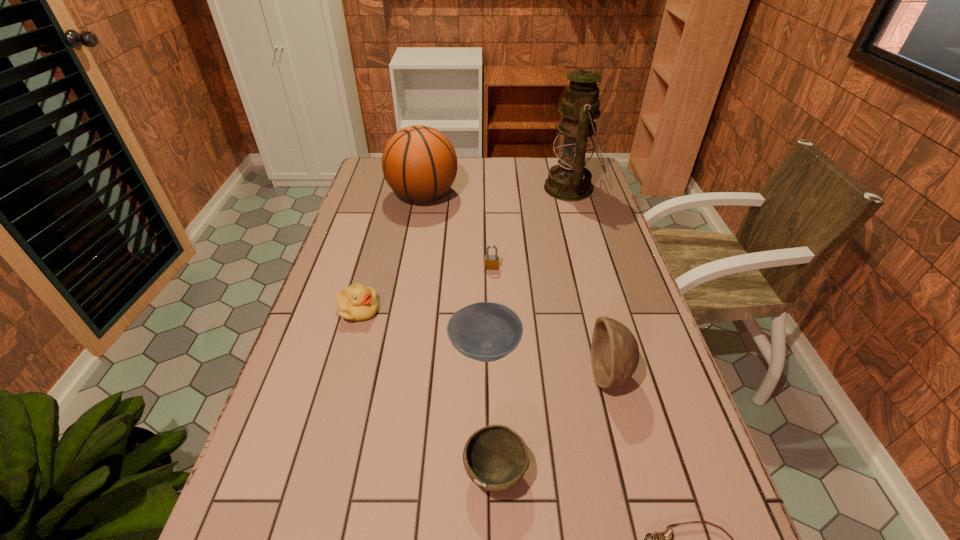
I want to click on vacant space located 0.190m on the beak of the duckling, so click(450, 310).

Identify the location of vacant space positioned 0.380m on the right of the third farthest object. (627, 267).

What are the coordinates of `vacant space located on the back of the nearest bowl` in the screenshot? It's located at (493, 420).

What are the coordinates of `oil lamp present at the far edge` in the screenshot? It's located at (569, 180).

Where is `basketball at the far edge`? basketball at the far edge is located at coordinates (419, 163).

You are a GUI agent. You are given a task and a screenshot of the screen. Output one action in this format:
    pyautogui.click(x=<x>, y=<y>)
    Task: Click on the basketball present at the left edge
    
    Given the screenshot: What is the action you would take?
    pyautogui.click(x=419, y=163)

Identify the location of duckling present at the left edge. The image size is (960, 540). (357, 303).

This screenshot has width=960, height=540. I want to click on oil lamp at the right edge, so click(569, 180).

I want to click on bowl that is at the right edge, so click(614, 350).

Image resolution: width=960 pixels, height=540 pixels. In order to click on object situated at the far left corner in this screenshot , I will do `click(419, 163)`.